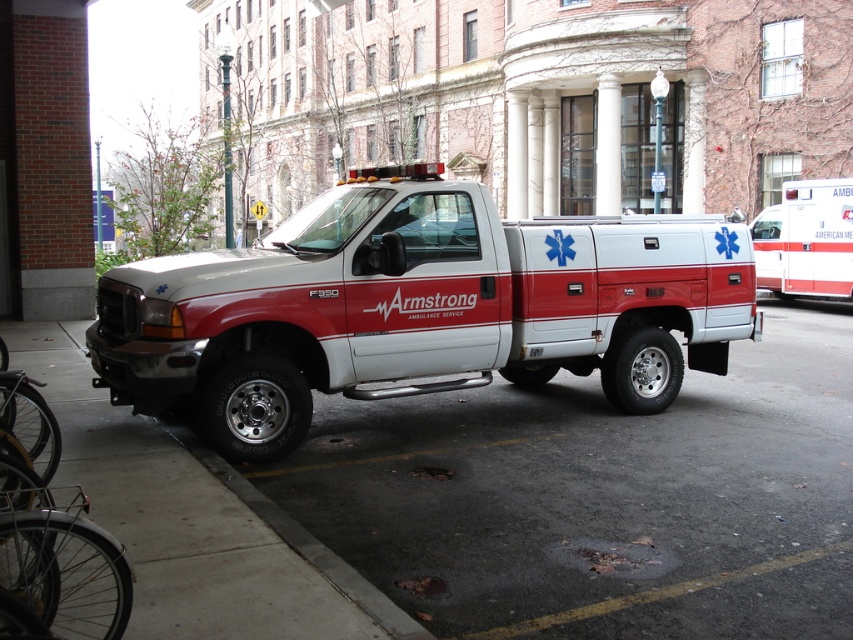
Who is taller, smooth asphalt at center or white matte ambulance at center?

Standing taller between the two is smooth asphalt at center.

In the scene shown: Measure the distance between smooth asphalt at center and white matte ambulance at center.

They are 9.89 feet apart.

Does point (729, 420) come farther from viewer compared to point (434, 170)?

Yes.

Identify the location of smooth asphalt at center. (601, 497).

From the picture: Can you confirm if smooth asphalt at center is positioned to the right of white glossy ambulance at right?

No, smooth asphalt at center is not to the right of white glossy ambulance at right.

Is smooth asphalt at center wider than white glossy ambulance at right?

Correct, the width of smooth asphalt at center exceeds that of white glossy ambulance at right.

Measure the distance between smooth asphalt at center and camera.

smooth asphalt at center and camera are 3.12 meters apart.

At what (x,y) coordinates should I click in order to perform the action: click on smooth asphalt at center. Please return your answer as a coordinate pair (x, y). This screenshot has height=640, width=853. Looking at the image, I should click on (601, 497).

Is point (143, 310) more distant than point (825, 209)?

No, it is not.

Who is positioned more to the right, white matte ambulance at center or white glossy ambulance at right?

white glossy ambulance at right is more to the right.

Between point (97, 292) and point (828, 252), which one is positioned in front?

Point (97, 292)

Find the location of a particular element. The height and width of the screenshot is (640, 853). white matte ambulance at center is located at coordinates (416, 307).